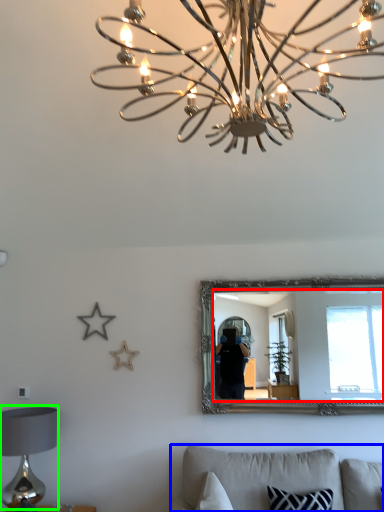
Question: Which object is positioned closest to mirror (highlighted by a red box)? Select from furniture (highlighted by a blue box) and table lamp (highlighted by a green box).

Choices:
 (A) furniture
 (B) table lamp

Answer: (A)